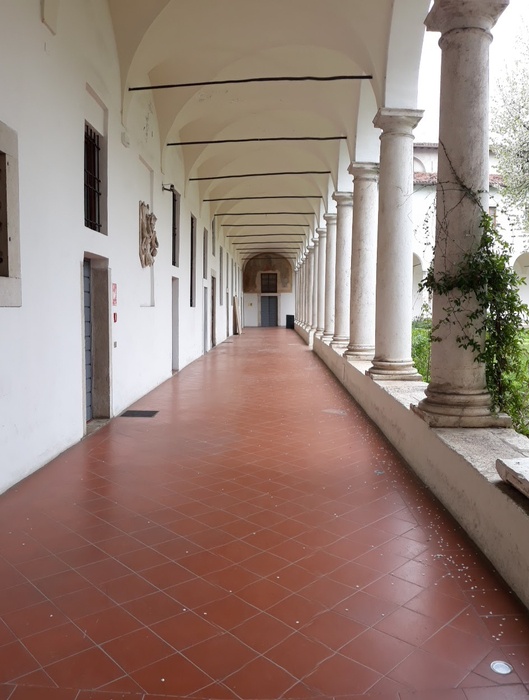
Find the location of `pillar`. pillar is located at coordinates 384,312.